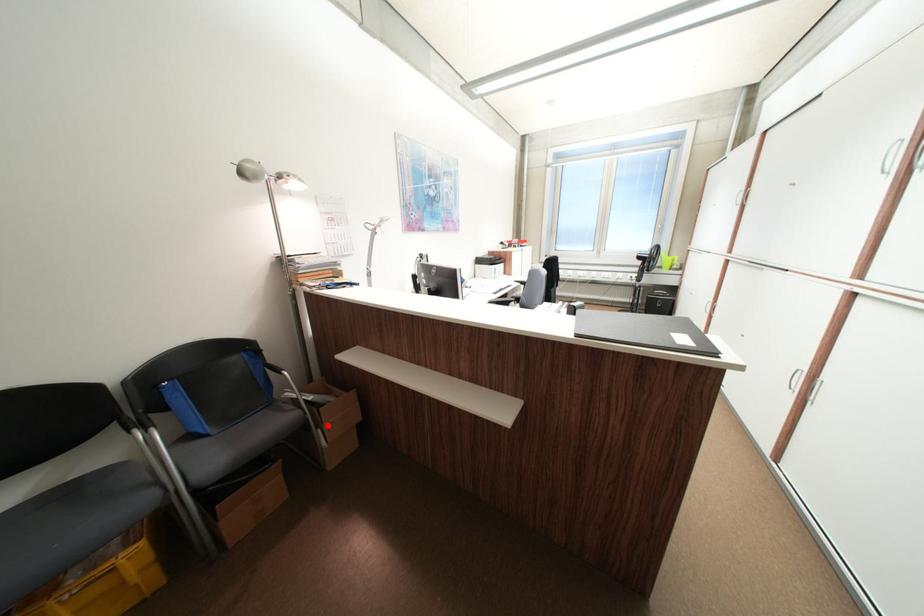
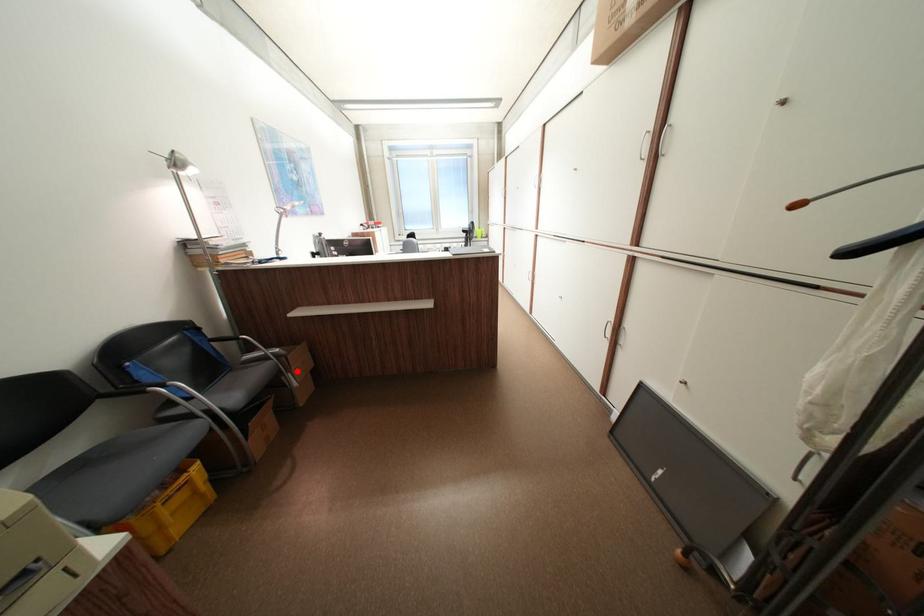
I am providing you with two images of the same scene from different viewpoints. A red point is marked on the first image and another point is marked on the second image. Do the highlighted points in image1 and image2 indicate the same real-world spot?

Yes